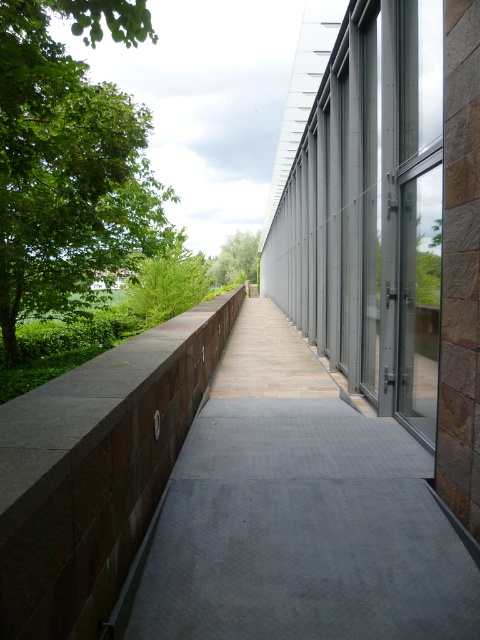
Question: Which point is farther to the camera?

Choices:
 (A) (372, 433)
 (B) (255, 241)

Answer: (B)

Question: Can you confirm if rustic stone pavement at left is thinner than green leafy tree at left?

Choices:
 (A) yes
 (B) no

Answer: (A)

Question: Based on their relative distances, which object is farther from the green leafy tree at upper left?

Choices:
 (A) rustic stone pavement at left
 (B) green leafy tree at center

Answer: (B)

Question: Does green leafy tree at upper left have a lesser width compared to green leafy tree at center?

Choices:
 (A) no
 (B) yes

Answer: (B)

Question: Which point is closer to the camera?

Choices:
 (A) rustic stone pavement at left
 (B) green leafy tree at upper left
 (C) green leafy tree at center
 (D) green leafy tree at left

Answer: (A)

Question: Is green leafy tree at left closer to the viewer compared to green leafy tree at center?

Choices:
 (A) no
 (B) yes

Answer: (B)